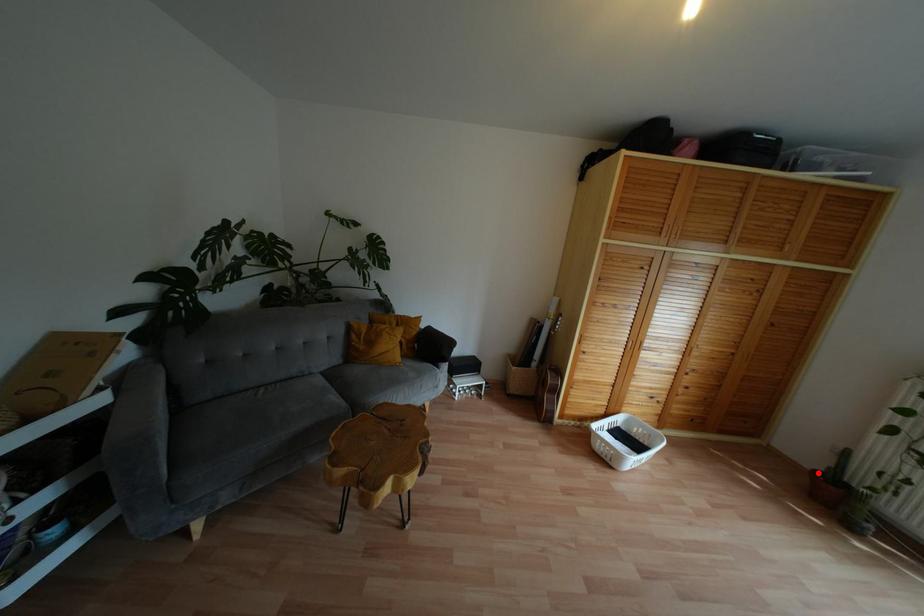
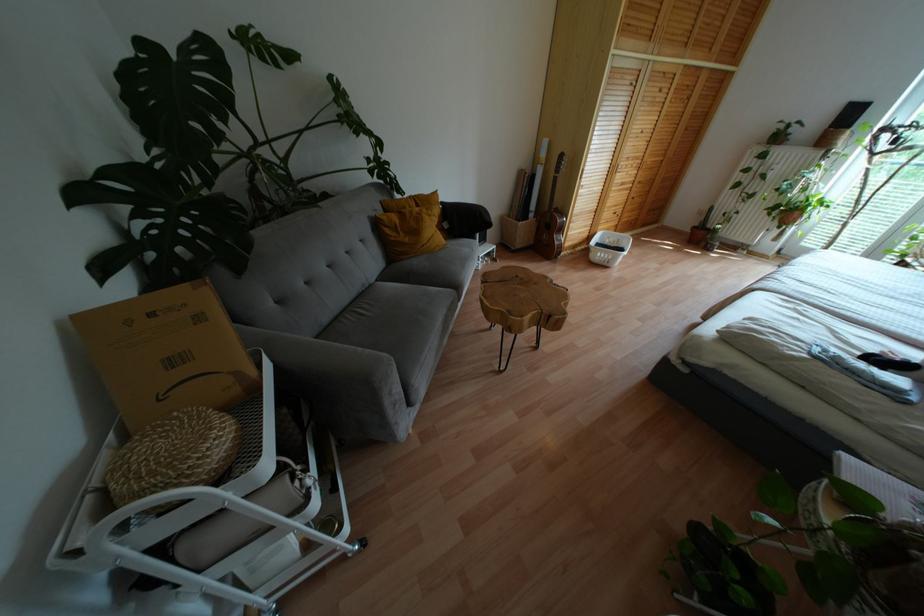
The point at the highlighted location is marked in the first image. Where is the corresponding point in the second image?

(694, 227)